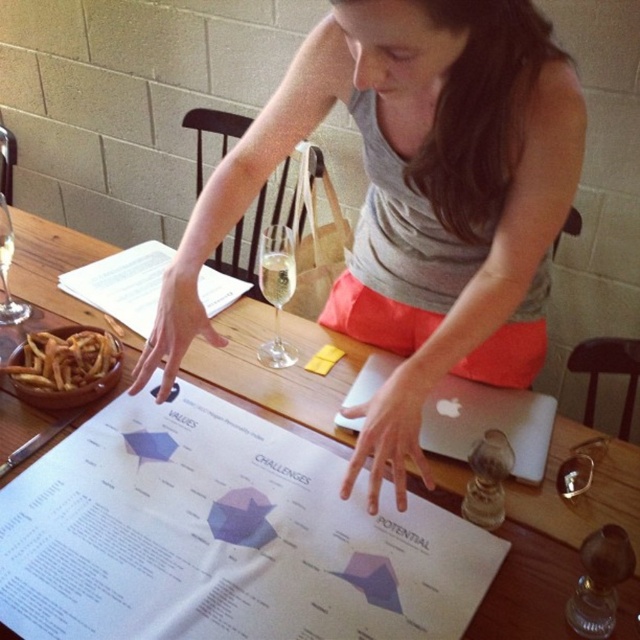
Which is above, white paper document at center or white wood table at center?

white wood table at center is above.

Can you confirm if white paper document at center is shorter than white wood table at center?

Yes.

Between point (403, 576) and point (300, 321), which one is positioned behind?

Positioned behind is point (300, 321).

Locate an element on the screen. This screenshot has width=640, height=640. white paper document at center is located at coordinates (224, 538).

Between gray fabric shirt at center and clear glass wine at center, which one appears on the right side from the viewer's perspective?

Positioned to the right is gray fabric shirt at center.

Describe the element at coordinates (412, 188) in the screenshot. Image resolution: width=640 pixels, height=640 pixels. I see `gray fabric shirt at center` at that location.

I want to click on gray fabric shirt at center, so click(412, 188).

Between gray fabric shirt at center and white paper document at center, which one appears on the left side from the viewer's perspective?

Positioned to the left is white paper document at center.

The image size is (640, 640). What are the coordinates of `gray fabric shirt at center` in the screenshot? It's located at (412, 188).

You are a GUI agent. You are given a task and a screenshot of the screen. Output one action in this format:
    pyautogui.click(x=<x>, y=<y>)
    Task: Click on the gray fabric shirt at center
    
    Given the screenshot: What is the action you would take?
    pyautogui.click(x=412, y=188)